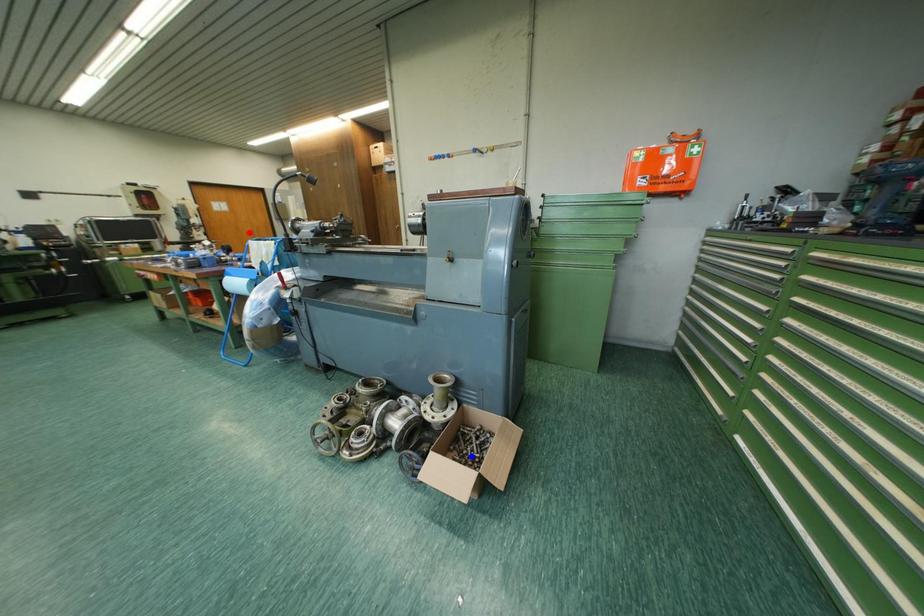
Question: Which of the two points in the image is closer to the camera?

Choices:
 (A) Blue point is closer.
 (B) Red point is closer.

Answer: (A)